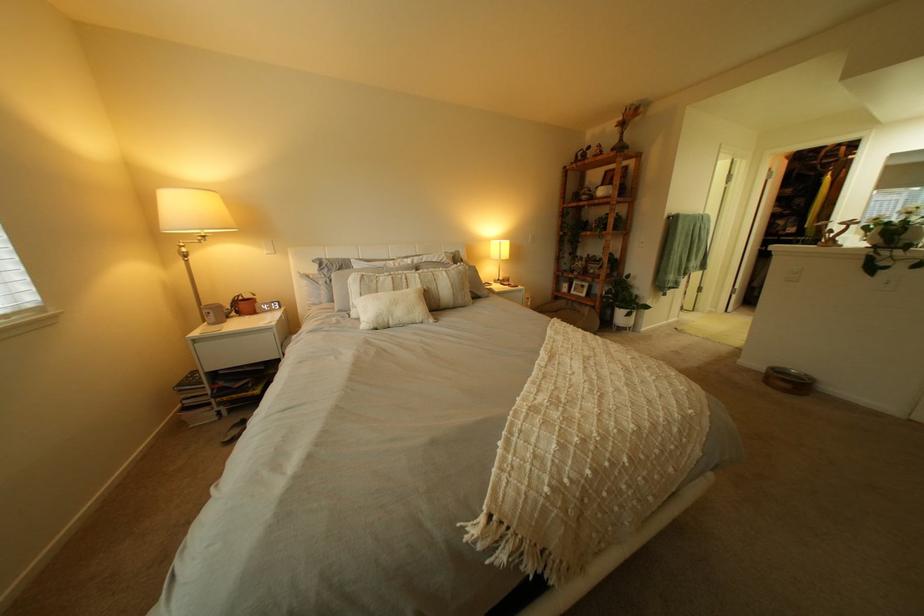
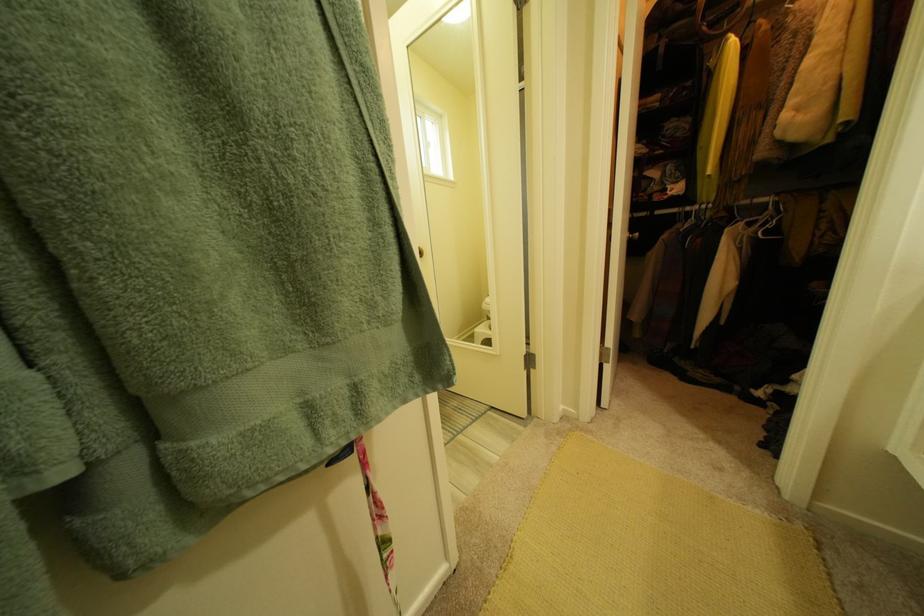
Which direction would the cameraman need to move to produce the second image?

The cameraman walked toward right, forward.